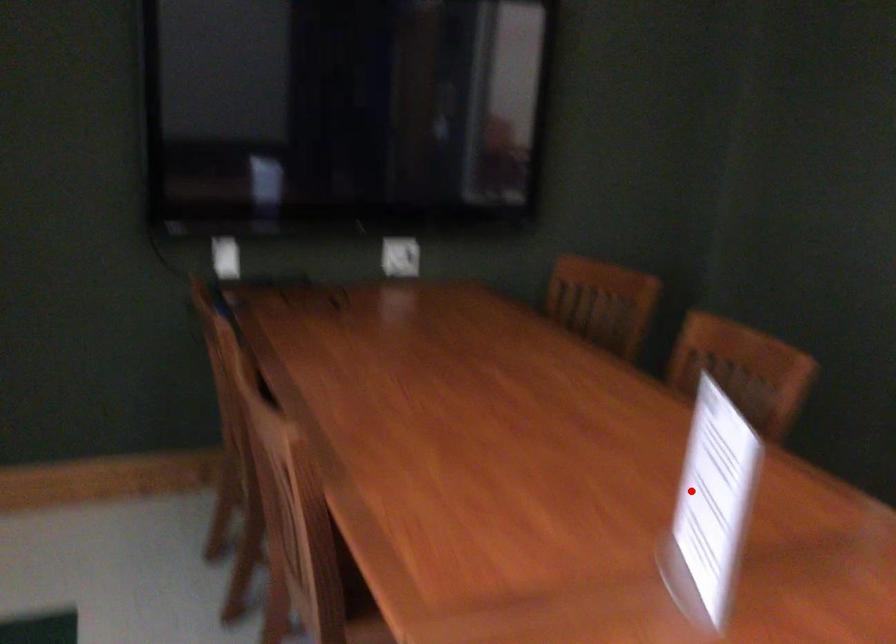
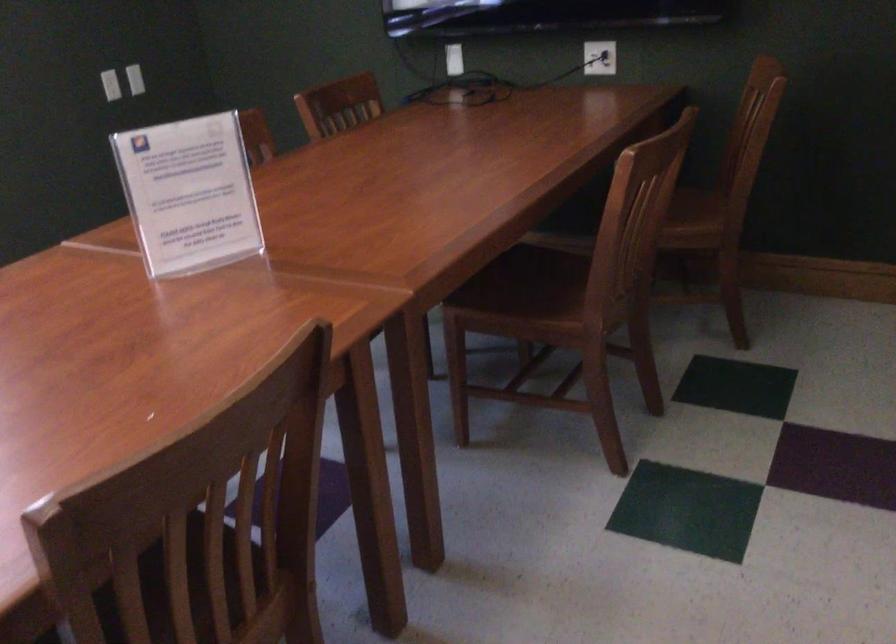
Question: I am providing you with two images of the same scene from different viewpoints. Given a red point in image1, look at the same physical point in image2. Is it:

Choices:
 (A) Closer to the viewpoint
 (B) Farther from the viewpoint

Answer: (B)